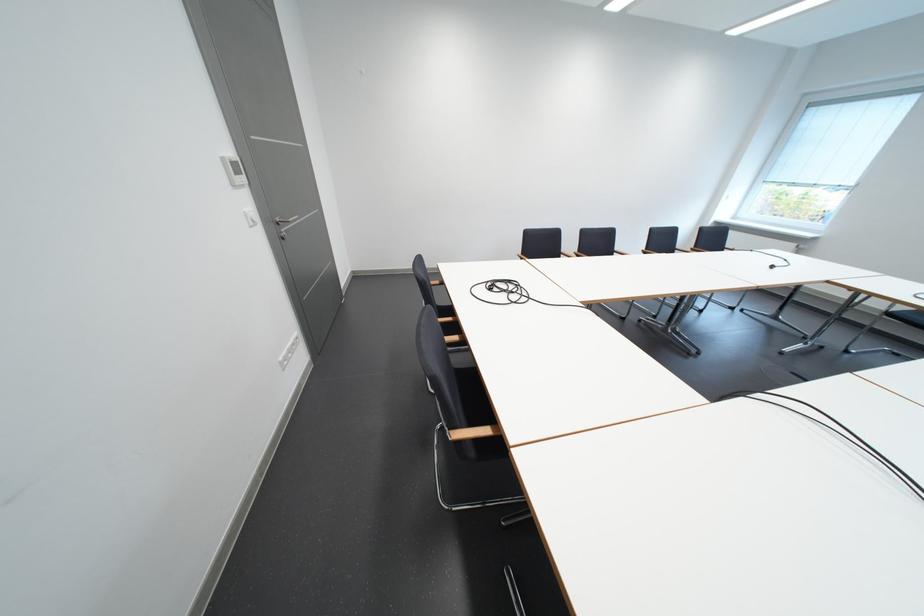
The height and width of the screenshot is (616, 924). What do you see at coordinates (234, 171) in the screenshot?
I see `the white light switch` at bounding box center [234, 171].